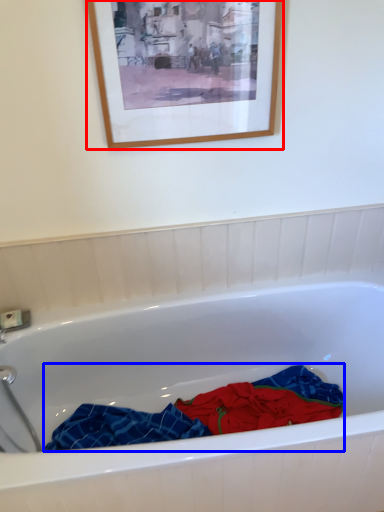
Question: Among these objects, which one is farthest to the camera, picture frame (highlighted by a red box) or material (highlighted by a blue box)?

Choices:
 (A) picture frame
 (B) material

Answer: (B)